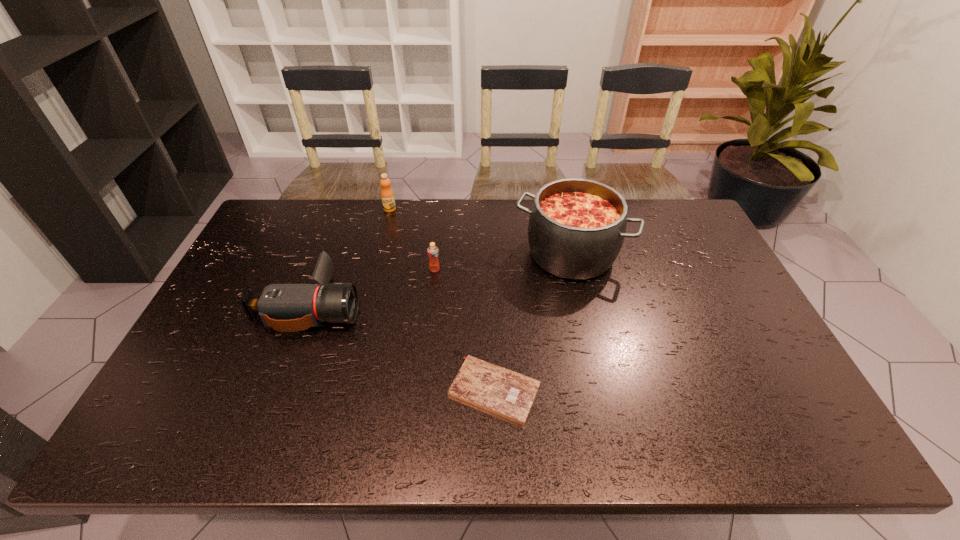
The width and height of the screenshot is (960, 540). I want to click on vacant space located 0.080m on the lens of the camcorder, so click(388, 306).

At what (x,y) coordinates should I click in order to perform the action: click on free space located on the front of the right orange juice. Please return your answer as a coordinate pair (x, y). Image resolution: width=960 pixels, height=540 pixels. Looking at the image, I should click on (430, 309).

Where is `vacant space located on the back of the Bible`? The image size is (960, 540). vacant space located on the back of the Bible is located at coordinates (493, 337).

Identify the location of casserole that is positioned at the far edge. (577, 226).

At what (x,y) coordinates should I click in order to perform the action: click on orange juice positioned at the far edge. Please return your answer as a coordinate pair (x, y). Looking at the image, I should click on (387, 195).

You are a GUI agent. You are given a task and a screenshot of the screen. Output one action in this format:
    pyautogui.click(x=<x>, y=<y>)
    Task: Click on the object present at the near edge
    This screenshot has width=960, height=540.
    Given the screenshot: What is the action you would take?
    pyautogui.click(x=503, y=392)

Identify the location of object present at the left edge. (285, 307).

Identify the location of vacant area at the far edge. The image size is (960, 540). (382, 213).

Where is `vacant point at the near edge`? This screenshot has height=540, width=960. vacant point at the near edge is located at coordinates (254, 424).

This screenshot has height=540, width=960. What are the coordinates of `blank space at the left edge` in the screenshot? It's located at (231, 307).